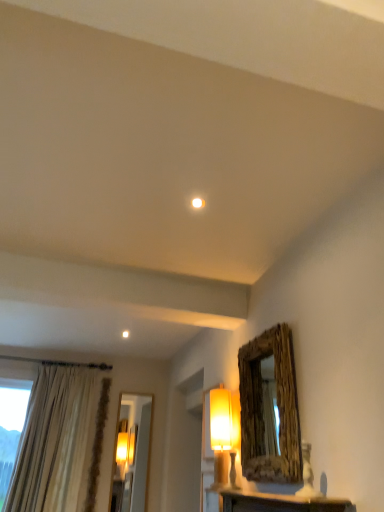
Question: Is wooden frame mirror at upper right taller or shorter than white glossy light bulb at center?

Choices:
 (A) tall
 (B) short

Answer: (A)

Question: Would you say wooden frame mirror at upper right is inside or outside white glossy light bulb at center?

Choices:
 (A) outside
 (B) inside

Answer: (A)

Question: Which of these objects is positioned closest to the beige textured curtain at left?

Choices:
 (A) white glossy light bulb at center
 (B) wooden frame mirror at upper right
 (C) matte yellow fabric lampshade at center-right
 (D) white marble table at lower center

Answer: (C)

Question: Estimate the real-world distances between objects in this image. Which object is farther from the wooden frame mirror at upper right?

Choices:
 (A) white glossy light bulb at center
 (B) matte yellow fabric lampshade at center-right
 (C) beige textured curtain at left
 (D) white marble table at lower center

Answer: (C)